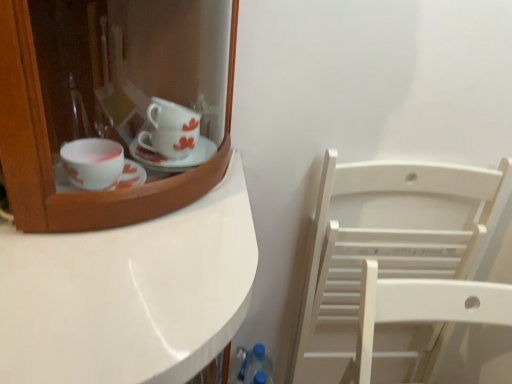
Locate an element on the screen. This screenshot has height=384, width=512. white wood chair at right is located at coordinates (387, 243).

What do you see at coordinates (387, 243) in the screenshot?
I see `white wood chair at right` at bounding box center [387, 243].

This screenshot has width=512, height=384. I want to click on white wood chair at right, so click(x=387, y=243).